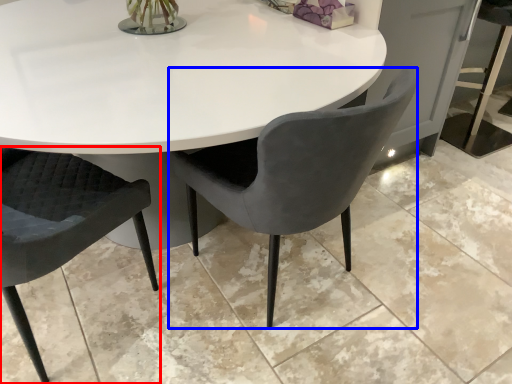
Question: Which of the following is the farthest to the observer, chair (highlighted by a red box) or chair (highlighted by a blue box)?

Choices:
 (A) chair
 (B) chair

Answer: (B)